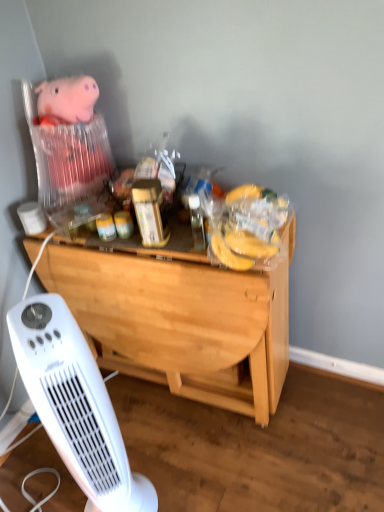
Question: Is the position of white plastic heater at lower left less distant than that of light wood desk at center?

Choices:
 (A) yes
 (B) no

Answer: (A)

Question: Is white plastic heater at lower left smaller than light wood desk at center?

Choices:
 (A) yes
 (B) no

Answer: (A)

Question: Is light wood desk at center at the back of white plastic heater at lower left?

Choices:
 (A) no
 (B) yes

Answer: (A)

Question: Is white plastic heater at lower left at the left side of light wood desk at center?

Choices:
 (A) no
 (B) yes

Answer: (B)

Question: Does white plastic heater at lower left have a lesser height compared to light wood desk at center?

Choices:
 (A) no
 (B) yes

Answer: (A)

Question: In terms of height, does plush pink pig at upper left look taller or shorter compared to light wood desk at center?

Choices:
 (A) tall
 (B) short

Answer: (B)

Question: Does point (41, 177) appear closer or farther from the camera than point (258, 307)?

Choices:
 (A) closer
 (B) farther

Answer: (B)

Question: From a real-world perspective, is plush pink pig at upper left positioned above or below light wood desk at center?

Choices:
 (A) below
 (B) above

Answer: (B)

Question: Based on their sizes in the image, would you say plush pink pig at upper left is bigger or smaller than light wood desk at center?

Choices:
 (A) big
 (B) small

Answer: (B)

Question: Is point (82, 356) positioned closer to the camera than point (109, 148)?

Choices:
 (A) closer
 (B) farther

Answer: (A)

Question: In the image, is white plastic heater at lower left on the left side or the right side of plush pink pig at upper left?

Choices:
 (A) left
 (B) right

Answer: (B)

Question: Which is correct: white plastic heater at lower left is inside plush pink pig at upper left, or outside of it?

Choices:
 (A) inside
 (B) outside

Answer: (B)

Question: Relative to plush pink pig at upper left, is white plastic heater at lower left in front or behind?

Choices:
 (A) behind
 (B) front

Answer: (B)

Question: Which is correct: plush pink pig at upper left is inside white plastic heater at lower left, or outside of it?

Choices:
 (A) outside
 (B) inside

Answer: (A)

Question: From the image's perspective, is plush pink pig at upper left positioned above or below white plastic heater at lower left?

Choices:
 (A) below
 (B) above

Answer: (B)